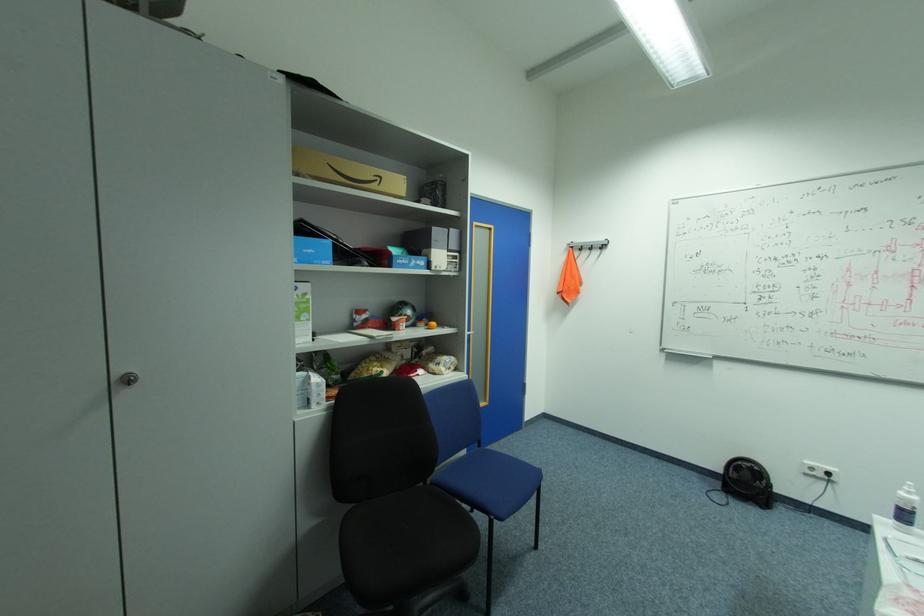
The image size is (924, 616). I want to click on black chair sitting surface, so click(408, 540).